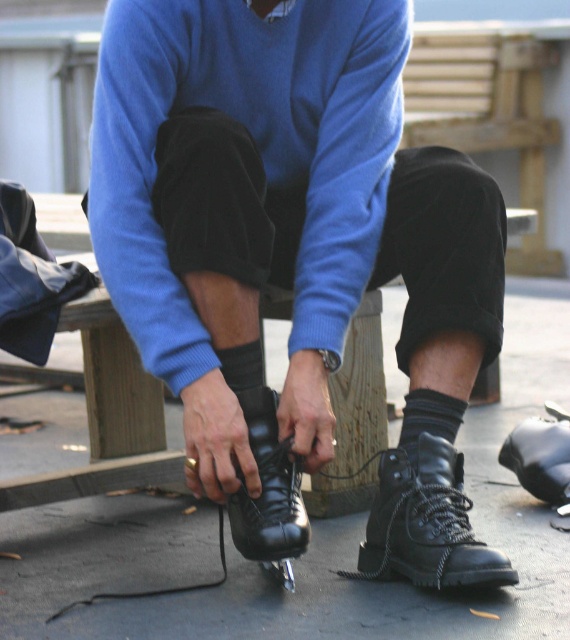
Question: Is black leather boot at lower center positioned at the back of black leather skate at center?

Choices:
 (A) no
 (B) yes

Answer: (A)

Question: Which is farther from the black leather boot at lower center?

Choices:
 (A) black leather skate at center
 (B) shiny black ice skate at center

Answer: (A)

Question: Which of the following is the farthest from the observer?

Choices:
 (A) (441, 548)
 (B) (279, 451)

Answer: (B)

Question: Does shiny black ice skate at center appear on the right side of black leather skate at center?

Choices:
 (A) yes
 (B) no

Answer: (A)

Question: Which point is closer to the camera?

Choices:
 (A) (310, 132)
 (B) (388, 576)
 (C) (279, 492)

Answer: (C)

Question: Is shiny black ice skate at center closer to the viewer compared to black leather skate at center?

Choices:
 (A) no
 (B) yes

Answer: (B)